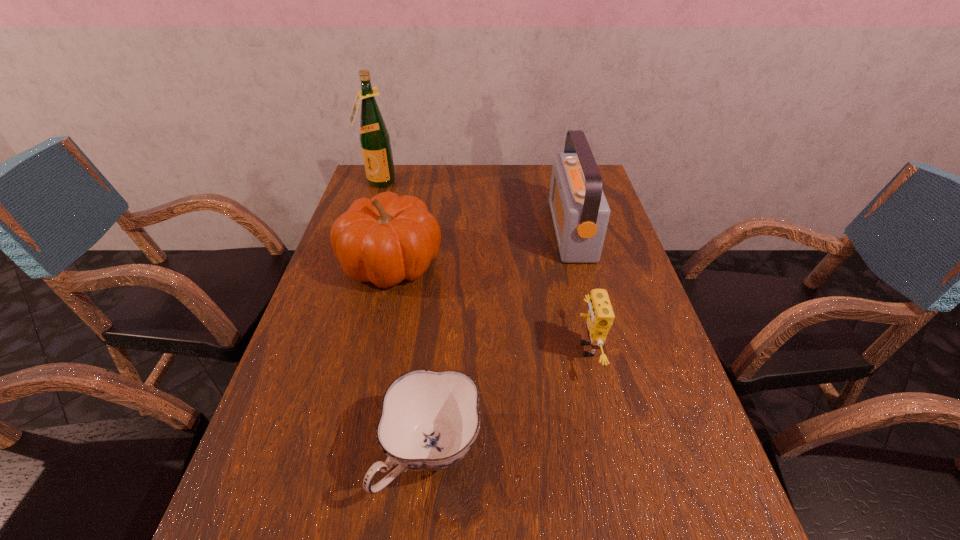
Locate which object ranks fourth in proximity to the tallest object. Please provide its 2D coordinates. Your answer should be formatted as a tuple, i.e. [(x, y)], where the tuple contains the x and y coordinates of a point satisfying the conditions above.

[(429, 420)]

Locate an element on the screen. This screenshot has width=960, height=540. vacant region that satisfies the following two spatial constraints: 1. on the front-facing side of the farthest object; 2. on the left side of the shortest object is located at coordinates (287, 454).